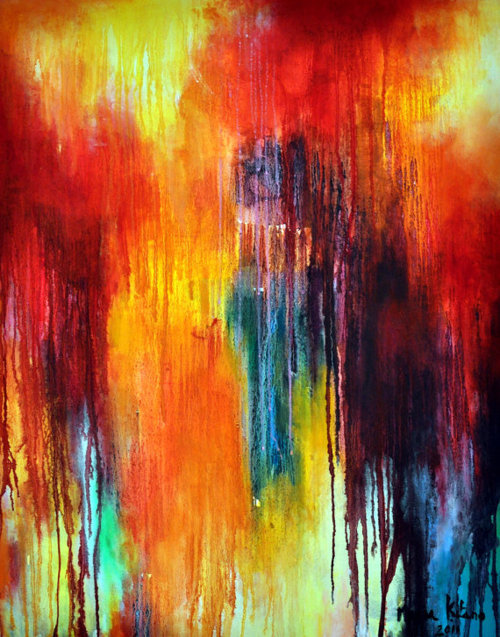
The height and width of the screenshot is (637, 500). What are the coordinates of `abstract art` in the screenshot? It's located at (261, 303).